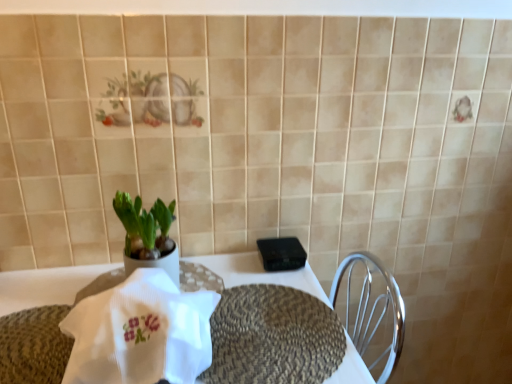
Question: Considering the relative sizes of braided woven placemat at center and black plastic device at center in the image provided, is braided woven placemat at center smaller than black plastic device at center?

Choices:
 (A) no
 (B) yes

Answer: (A)

Question: Can you confirm if braided woven placemat at center is positioned to the right of black plastic device at center?

Choices:
 (A) no
 (B) yes

Answer: (A)

Question: Does braided woven placemat at center come behind black plastic device at center?

Choices:
 (A) no
 (B) yes

Answer: (A)

Question: Is braided woven placemat at center surrounding black plastic device at center?

Choices:
 (A) yes
 (B) no

Answer: (B)

Question: From a real-world perspective, does braided woven placemat at center sit lower than black plastic device at center?

Choices:
 (A) yes
 (B) no

Answer: (A)

Question: Is black plastic device at center at the back of braided woven placemat at center?

Choices:
 (A) no
 (B) yes

Answer: (A)

Question: From a real-world perspective, is green matte plant at center beneath black plastic device at center?

Choices:
 (A) yes
 (B) no

Answer: (B)

Question: Is green matte plant at center located outside black plastic device at center?

Choices:
 (A) yes
 (B) no

Answer: (A)

Question: Is the depth of green matte plant at center less than that of black plastic device at center?

Choices:
 (A) no
 (B) yes

Answer: (B)

Question: Are green matte plant at center and black plastic device at center making contact?

Choices:
 (A) no
 (B) yes

Answer: (A)

Question: Is the position of green matte plant at center more distant than that of black plastic device at center?

Choices:
 (A) no
 (B) yes

Answer: (A)

Question: From the image's perspective, is green matte plant at center located beneath black plastic device at center?

Choices:
 (A) no
 (B) yes

Answer: (A)

Question: From a real-world perspective, is black plastic device at center over white ribbed cloth at center?

Choices:
 (A) yes
 (B) no

Answer: (B)